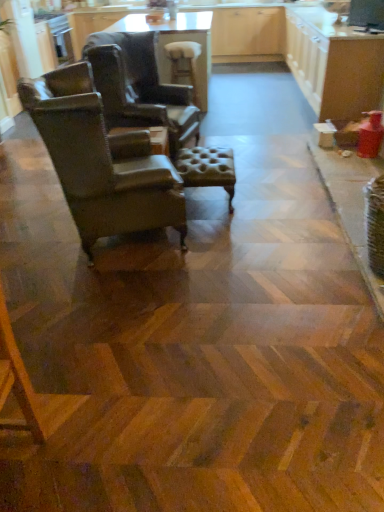
Where is `white fabric bar stool at center, arranged as the second bar stool when ordered from the bottom`? white fabric bar stool at center, arranged as the second bar stool when ordered from the bottom is located at coordinates (184, 64).

The height and width of the screenshot is (512, 384). What do you see at coordinates (207, 168) in the screenshot? I see `tufted leather ottoman at center, which ranks as the 1th bar stool in bottom-to-top order` at bounding box center [207, 168].

Describe the element at coordinates (140, 87) in the screenshot. The image size is (384, 512). I see `leather wingback chair at left, the 1th chair from the back` at that location.

This screenshot has height=512, width=384. Identify the location of white glossy cabinets at upper right. (334, 63).

You are a GUI agent. You are given a task and a screenshot of the screen. Output one action in this format:
    pyautogui.click(x=<x>, y=<y>)
    Task: Click on the chair that is the 2nd object located below the wooden glossy table at upper center (from the image's perspective)
    This screenshot has width=384, height=512.
    Given the screenshot: What is the action you would take?
    pyautogui.click(x=101, y=161)

Can you confirm if brown leather chair at left, placed as the second chair when sorted from back to front, is taller than wooden glossy table at upper center?

Yes.

Is brown leather chair at left, placed as the second chair when sorted from back to front, bigger than wooden glossy table at upper center?

Actually, brown leather chair at left, placed as the second chair when sorted from back to front, might be smaller than wooden glossy table at upper center.

From a real-world perspective, is brown leather chair at left, the first chair from the front, positioned under wooden glossy table at upper center based on gravity?

Incorrect, from a real-world perspective, brown leather chair at left, the first chair from the front, is higher than wooden glossy table at upper center.

In the scene shown: Considering the relative positions of white fabric bar stool at center, which is the first bar stool in top-to-bottom order, and brown leather chair at left, the first chair from the front, in the image provided, is white fabric bar stool at center, which is the first bar stool in top-to-bottom order, to the right of brown leather chair at left, the first chair from the front, from the viewer's perspective?

Yes.

Where is `the 1st bar stool to the right when counting from the brown leather chair at left, the first chair from the front`? This screenshot has height=512, width=384. the 1st bar stool to the right when counting from the brown leather chair at left, the first chair from the front is located at coordinates (184, 64).

From a real-world perspective, relative to brown leather chair at left, the first chair from the front, is white fabric bar stool at center, the 2th bar stool from the front, vertically above or below?

Clearly, from a real-world perspective, white fabric bar stool at center, the 2th bar stool from the front, is below brown leather chair at left, the first chair from the front.

Is white fabric bar stool at center, marked as the 1th bar stool in a back-to-front arrangement, shorter than brown leather chair at left, the first chair from the front?

Indeed, white fabric bar stool at center, marked as the 1th bar stool in a back-to-front arrangement, has a lesser height compared to brown leather chair at left, the first chair from the front.

Is white fabric bar stool at center, marked as the 1th bar stool in a back-to-front arrangement, positioned far away from wooden glossy table at upper center?

No, white fabric bar stool at center, marked as the 1th bar stool in a back-to-front arrangement, is not far away from wooden glossy table at upper center.

Which object is positioned more to the right, white fabric bar stool at center, marked as the 1th bar stool in a back-to-front arrangement, or wooden glossy table at upper center?

From the viewer's perspective, white fabric bar stool at center, marked as the 1th bar stool in a back-to-front arrangement, appears more on the right side.

Considering the positions of points (172, 46) and (206, 71), is point (172, 46) farther from camera compared to point (206, 71)?

No, it is not.

Is white fabric bar stool at center, arranged as the second bar stool when ordered from the bottom, looking in the opposite direction of wooden glossy table at upper center?

No.

Who is smaller, tufted leather ottoman at center, which ranks as the 2th bar stool in back-to-front order, or leather wingback chair at left, the 1th chair from the back?

Smaller between the two is tufted leather ottoman at center, which ranks as the 2th bar stool in back-to-front order.

Is tufted leather ottoman at center, which ranks as the 1th bar stool in bottom-to-top order, behind leather wingback chair at left, positioned as the 2th chair in front-to-back order?

No, tufted leather ottoman at center, which ranks as the 1th bar stool in bottom-to-top order, is closer to the camera.

Does tufted leather ottoman at center, which is the 1th bar stool in front-to-back order, appear on the left side of leather wingback chair at left, positioned as the 2th chair in front-to-back order?

No, tufted leather ottoman at center, which is the 1th bar stool in front-to-back order, is not to the left of leather wingback chair at left, positioned as the 2th chair in front-to-back order.

Is tufted leather ottoman at center, the second bar stool viewed from the top, directly adjacent to leather wingback chair at left, positioned as the 2th chair in front-to-back order?

No, tufted leather ottoman at center, the second bar stool viewed from the top, is not in contact with leather wingback chair at left, positioned as the 2th chair in front-to-back order.

Does brown leather chair at left, placed as the second chair when sorted from back to front, turn towards leather wingback chair at left, positioned as the 2th chair in front-to-back order?

No, brown leather chair at left, placed as the second chair when sorted from back to front, is not oriented towards leather wingback chair at left, positioned as the 2th chair in front-to-back order.

From the image's perspective, which is below, brown leather chair at left, the first chair from the front, or leather wingback chair at left, positioned as the 2th chair in front-to-back order?

brown leather chair at left, the first chair from the front, appears lower in the image.

Is brown leather chair at left, placed as the second chair when sorted from back to front, wider than leather wingback chair at left, positioned as the 2th chair in front-to-back order?

Yes, brown leather chair at left, placed as the second chair when sorted from back to front, is wider than leather wingback chair at left, positioned as the 2th chair in front-to-back order.

The height and width of the screenshot is (512, 384). In order to click on chair in front of the leather wingback chair at left, the 1th chair from the back in this screenshot , I will do `click(101, 161)`.

Are white glossy cabinets at upper right and tufted leather ottoman at center, the second bar stool viewed from the top, far apart?

white glossy cabinets at upper right is positioned a significant distance from tufted leather ottoman at center, the second bar stool viewed from the top.

Is tufted leather ottoman at center, which ranks as the 2th bar stool in back-to-front order, located within white glossy cabinets at upper right?

No, tufted leather ottoman at center, which ranks as the 2th bar stool in back-to-front order, is not surrounded by white glossy cabinets at upper right.

Considering the sizes of objects white glossy cabinets at upper right and tufted leather ottoman at center, which is the 1th bar stool in front-to-back order, in the image provided, who is bigger, white glossy cabinets at upper right or tufted leather ottoman at center, which is the 1th bar stool in front-to-back order,?

Bigger between the two is white glossy cabinets at upper right.

From the image's perspective, is tufted leather ottoman at center, which is the 1th bar stool in front-to-back order, on white glossy cabinets at upper right?

No, from the image's perspective, tufted leather ottoman at center, which is the 1th bar stool in front-to-back order, is not on top of white glossy cabinets at upper right.

Can you confirm if tufted leather ottoman at center, the second bar stool viewed from the top, is smaller than white glossy cabinets at upper right?

Correct, tufted leather ottoman at center, the second bar stool viewed from the top, occupies less space than white glossy cabinets at upper right.

How many degrees apart are the facing directions of tufted leather ottoman at center, which is the 1th bar stool in front-to-back order, and white glossy cabinets at upper right?

The angle between the facing direction of tufted leather ottoman at center, which is the 1th bar stool in front-to-back order, and the facing direction of white glossy cabinets at upper right is 177 degrees.

Which is behind, tufted leather ottoman at center, which ranks as the 1th bar stool in bottom-to-top order, or white glossy cabinets at upper right?

white glossy cabinets at upper right is further away from the camera.

At what (x,y) coordinates should I click in order to perform the action: click on table located behind the brown leather chair at left, the first chair from the front. Please return your answer as a coordinate pair (x, y). Looking at the image, I should click on (177, 41).

Where is `bar stool that is the 1st one when counting rightward from the brown leather chair at left, placed as the second chair when sorted from back to front`? Image resolution: width=384 pixels, height=512 pixels. bar stool that is the 1st one when counting rightward from the brown leather chair at left, placed as the second chair when sorted from back to front is located at coordinates (184, 64).

From the image, which object appears to be nearer to white fabric bar stool at center, which is the first bar stool in top-to-bottom order, tufted leather ottoman at center, the second bar stool viewed from the top, or wooden glossy table at upper center?

wooden glossy table at upper center is positioned closer to the anchor white fabric bar stool at center, which is the first bar stool in top-to-bottom order.

Looking at the image, which one is located further to brown leather chair at left, placed as the second chair when sorted from back to front, wooden glossy table at upper center or white fabric bar stool at center, marked as the 1th bar stool in a back-to-front arrangement?

white fabric bar stool at center, marked as the 1th bar stool in a back-to-front arrangement, lies further to brown leather chair at left, placed as the second chair when sorted from back to front, than the other object.

When comparing their distances from white glossy cabinets at upper right, does brown leather chair at left, placed as the second chair when sorted from back to front, or leather wingback chair at left, positioned as the 2th chair in front-to-back order, seem further?

brown leather chair at left, placed as the second chair when sorted from back to front.

Estimate the real-world distances between objects in this image. Which object is closer to brown leather chair at left, the first chair from the front, white fabric bar stool at center, which is the first bar stool in top-to-bottom order, or wooden glossy table at upper center?

wooden glossy table at upper center is closer to brown leather chair at left, the first chair from the front.

Which object lies further to the anchor point brown leather chair at left, placed as the second chair when sorted from back to front, wooden glossy table at upper center or tufted leather ottoman at center, the second bar stool viewed from the top?

wooden glossy table at upper center lies further to brown leather chair at left, placed as the second chair when sorted from back to front, than the other object.

Based on their spatial positions, is brown leather chair at left, placed as the second chair when sorted from back to front, or white fabric bar stool at center, which is the first bar stool in top-to-bottom order, closer to wooden glossy table at upper center?

white fabric bar stool at center, which is the first bar stool in top-to-bottom order, is closer to wooden glossy table at upper center.

Considering their positions, is tufted leather ottoman at center, which ranks as the 2th bar stool in back-to-front order, positioned closer to wooden glossy table at upper center than white glossy cabinets at upper right?

white glossy cabinets at upper right is closer to wooden glossy table at upper center.

From the image, which object appears to be farther from white fabric bar stool at center, marked as the 1th bar stool in a back-to-front arrangement, white glossy cabinets at upper right or brown leather chair at left, the first chair from the front?

brown leather chair at left, the first chair from the front.

Image resolution: width=384 pixels, height=512 pixels. Identify the location of chair located between tufted leather ottoman at center, the second bar stool viewed from the top, and white fabric bar stool at center, marked as the 1th bar stool in a back-to-front arrangement, in the depth direction. pos(140,87).

In order to click on bar stool that lies between white glossy cabinets at upper right and tufted leather ottoman at center, which ranks as the 2th bar stool in back-to-front order, from top to bottom in this screenshot , I will do `click(184, 64)`.

Identify the location of bar stool between brown leather chair at left, placed as the second chair when sorted from back to front, and leather wingback chair at left, positioned as the 2th chair in front-to-back order, from front to back. This screenshot has width=384, height=512. (207, 168).

Locate an element on the screen. The width and height of the screenshot is (384, 512). bar stool between leather wingback chair at left, the 1th chair from the back, and wooden glossy table at upper center from front to back is located at coordinates (184, 64).